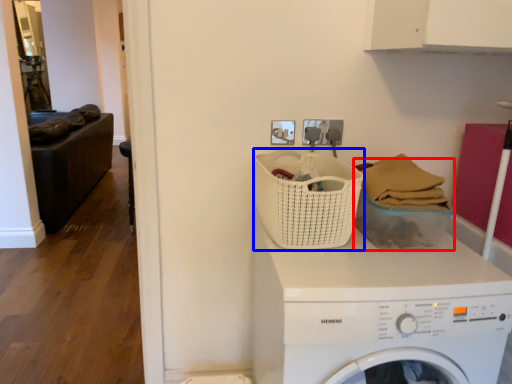
Question: Among these objects, which one is nearest to the camera, basket (highlighted by a red box) or basket (highlighted by a blue box)?

Choices:
 (A) basket
 (B) basket

Answer: (B)